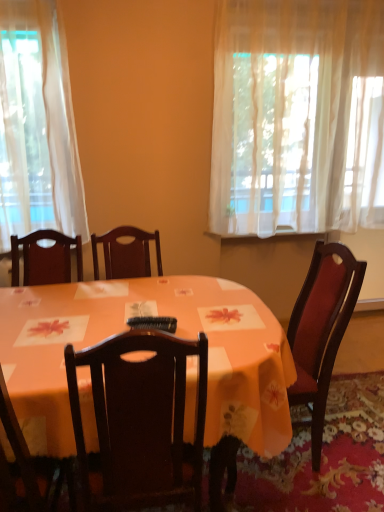
Question: Do you think wooden chair at lower left is within orange fabric table at center, or outside of it?

Choices:
 (A) inside
 (B) outside

Answer: (A)

Question: Visually, is wooden chair at lower left positioned to the left or to the right of orange fabric table at center?

Choices:
 (A) left
 (B) right

Answer: (A)

Question: Which is farther from the sheer white curtain at upper right?

Choices:
 (A) wooden chair at lower left
 (B) black plastic remote control at center
 (C) orange fabric table at center

Answer: (A)

Question: Which object is positioned farthest from the orange fabric table at center?

Choices:
 (A) sheer white curtain at upper right
 (B) wooden chair at lower left
 (C) black plastic remote control at center

Answer: (A)